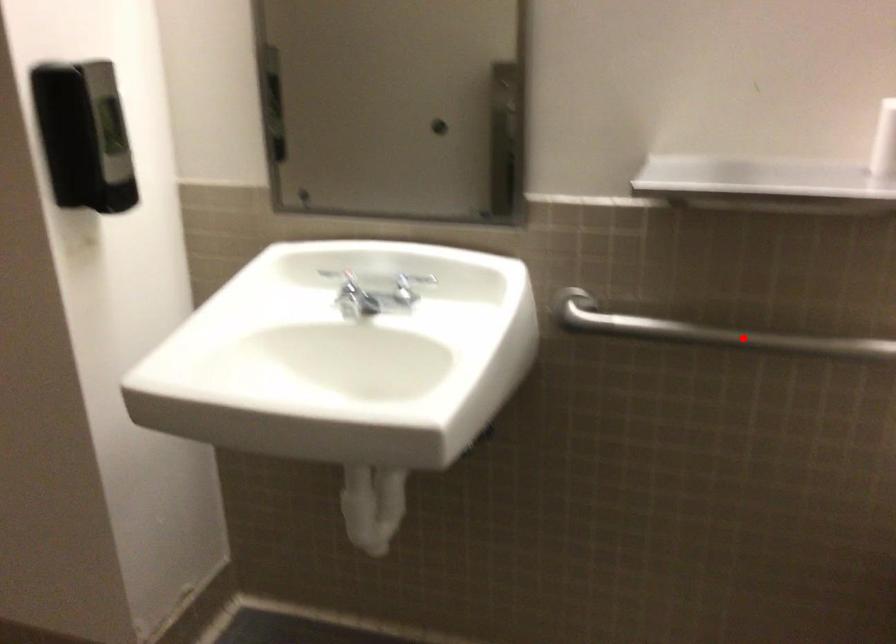
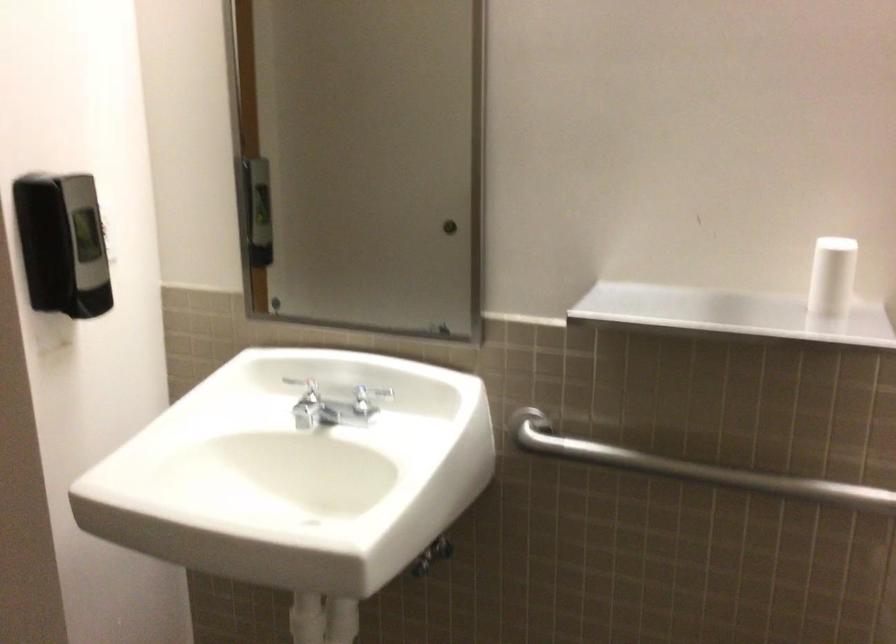
Where in the second image is the point corresponding to the highlighted location from the first image?

(691, 468)